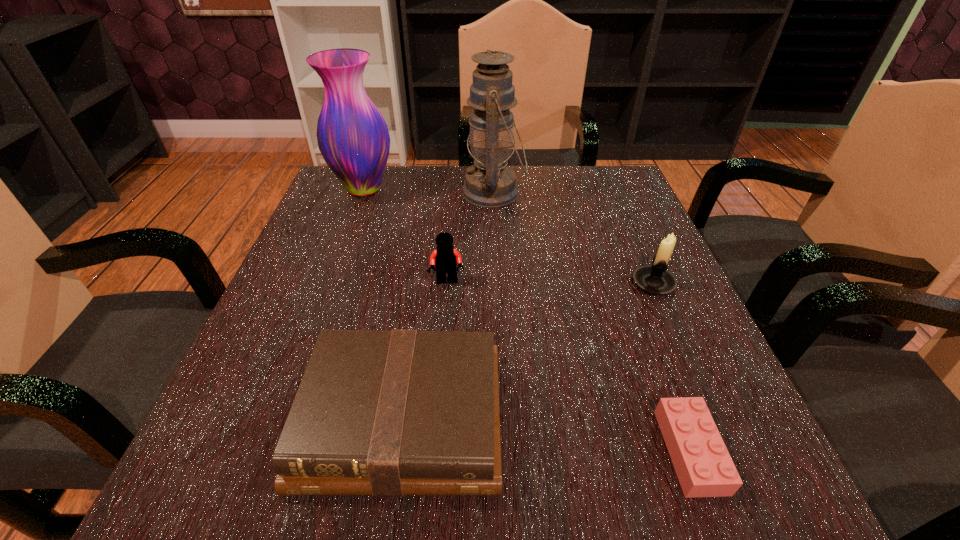
Identify the location of vacant area situated on the left of the fourth shortest object. This screenshot has height=540, width=960. (453, 284).

The height and width of the screenshot is (540, 960). In order to click on blank space located on the front-facing side of the farther Lego in this screenshot , I will do `click(443, 348)`.

The width and height of the screenshot is (960, 540). I want to click on blank area located 0.290m on the back of the right Lego, so click(626, 276).

Locate an element on the screen. The width and height of the screenshot is (960, 540). oil lamp located in the far edge section of the desktop is located at coordinates (x=491, y=183).

Where is `vase at the far edge`? Image resolution: width=960 pixels, height=540 pixels. vase at the far edge is located at coordinates (353, 138).

Find the location of `Bible at the near edge`. Bible at the near edge is located at coordinates (388, 413).

Identify the location of Lego located at the near edge. (703, 465).

Locate an element on the screen. vase positioned at the left edge is located at coordinates (353, 138).

Where is `Bible located at the left edge`? Bible located at the left edge is located at coordinates (388, 413).

Locate an element on the screen. candle holder that is at the right edge is located at coordinates (656, 279).